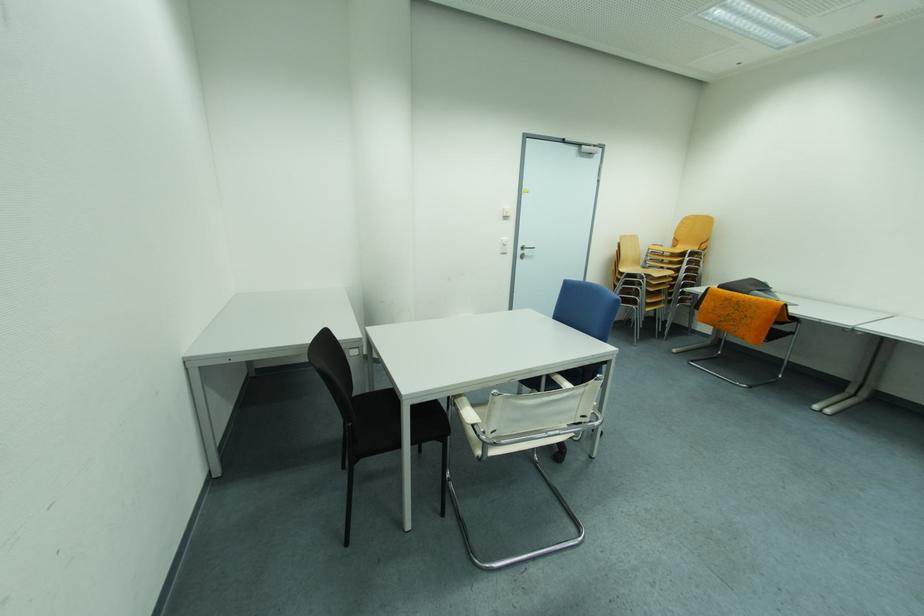
Describe the element at coordinates (466, 410) in the screenshot. This screenshot has height=616, width=924. I see `the white chair armrest` at that location.